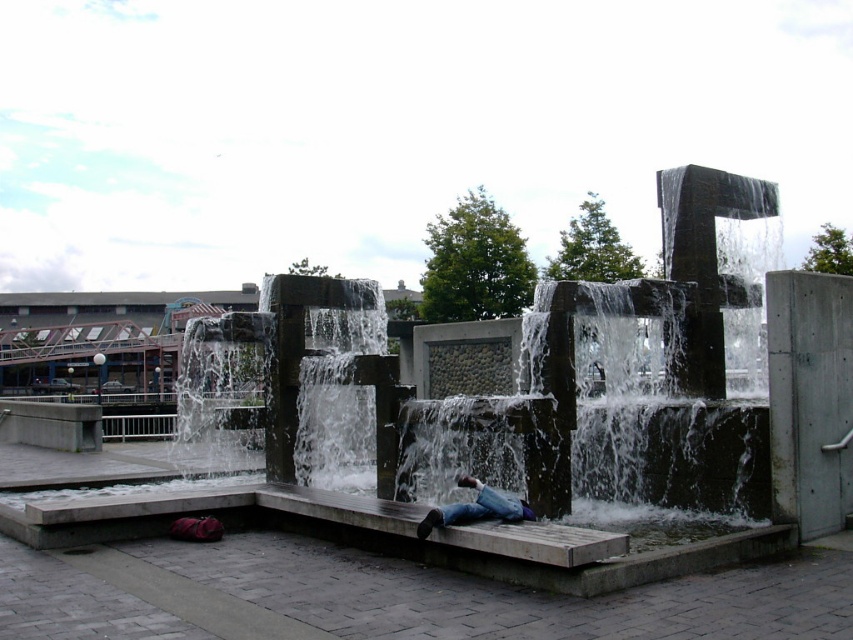
You are a photographer trying to capture the entire view of the concrete water at center and the blue jeans at center in one shot. Based on their sizes, which object should you focus on to ensure both are fully visible in the frame?

Since the concrete water at center is wider than the blue jeans at center, you should focus on the concrete water at center to ensure both objects are fully visible in the frame.

You are standing at the origin point in the coordinate system of the image. You want to place a small potted plant exactly 0.3 units to the right and 0.2 units above the concrete water at center. What are the coordinates where you should place the potted plant?

The concrete water at center is located at coordinates point (376, 474). Adding 0.3 units to the right increases the x coordinate to 1.042, and adding 0.2 units upward increases the y coordinate to 0.642. Therefore, the potted plant should be placed at coordinates point (547, 639).

You are a park visitor who wants to place your red bag on the concrete water at center without getting it wet. Since the blue jeans at center is already on the slab, where should you place the red bag to keep it dry?

The concrete water at center is positioned on the left side of blue jeans at center, so placing the red bag on the right side of blue jeans at center would keep it away from the water and dry.